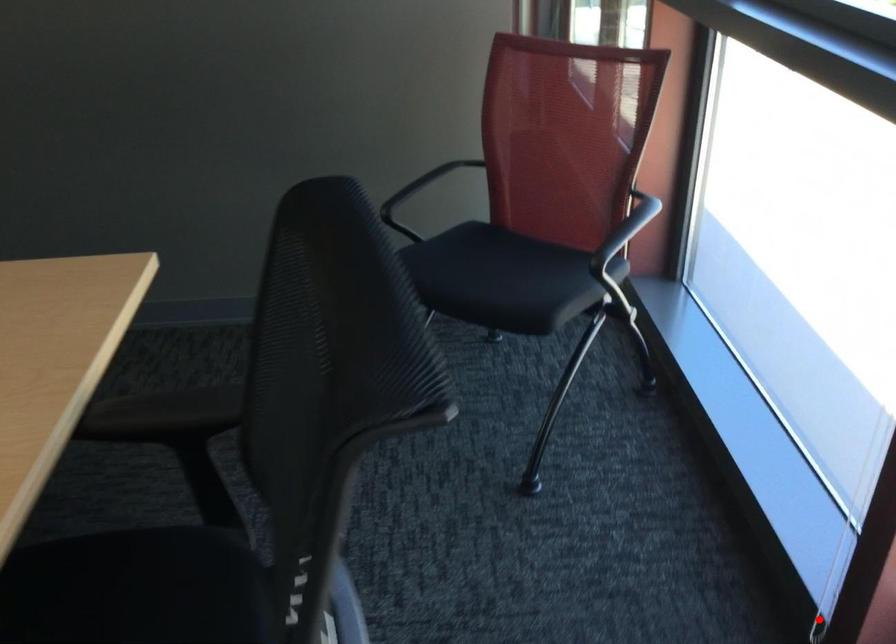
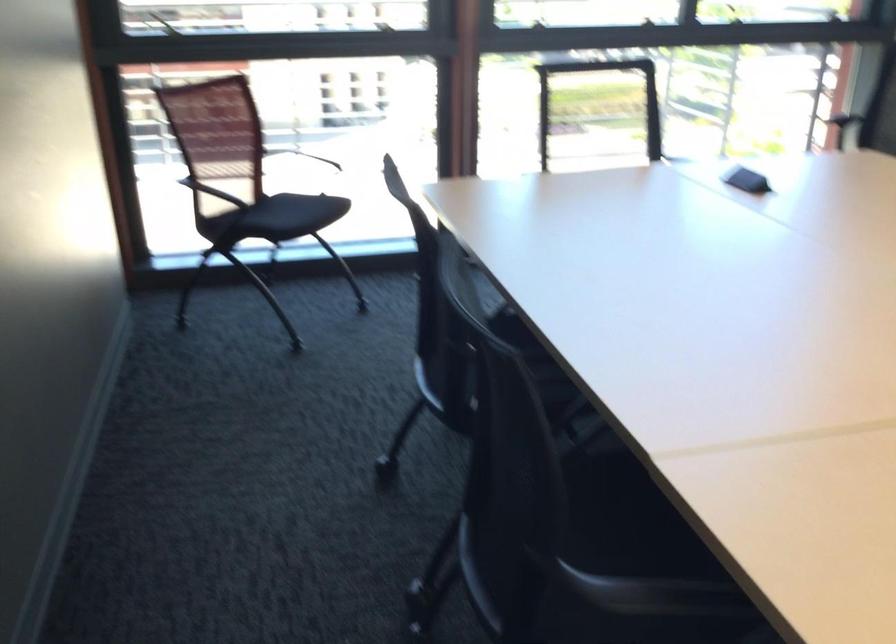
Question: I am providing you with two images of the same scene from different viewpoints. A red point is marked on the first image. At the location where the point appears in image 1, is it still visible in image 2?

Choices:
 (A) Yes
 (B) No

Answer: (B)